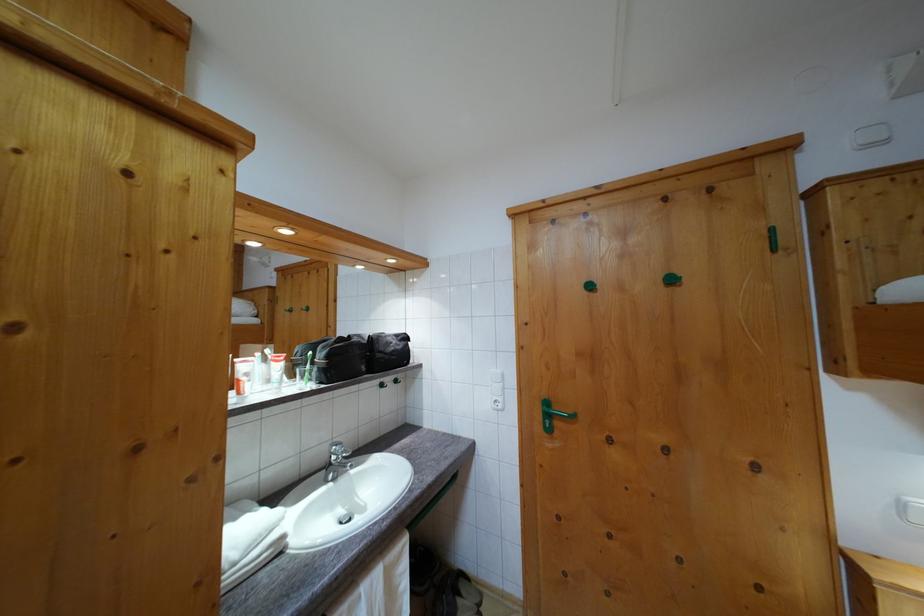
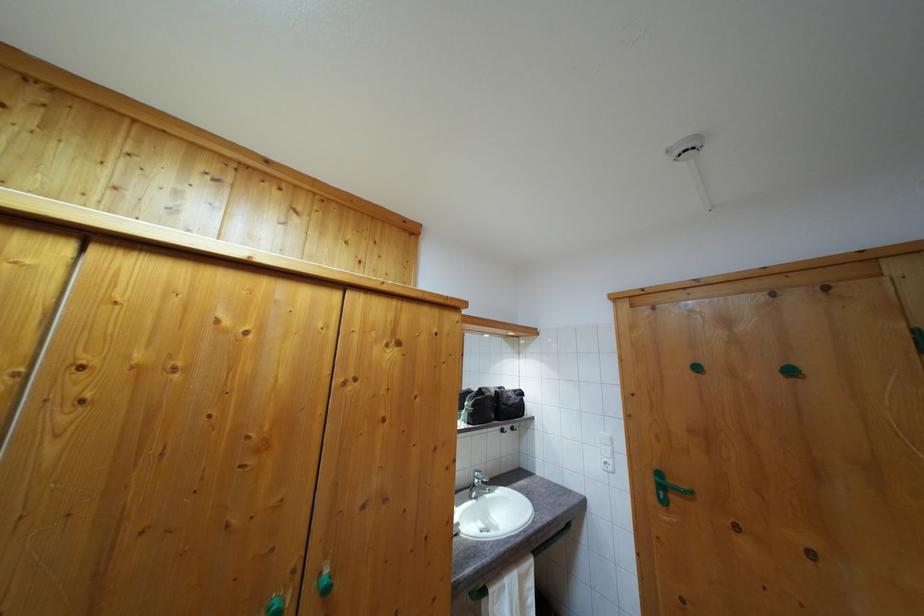
Where in the second image is the point corresponding to pixel 552 422 from the first image?

(664, 493)